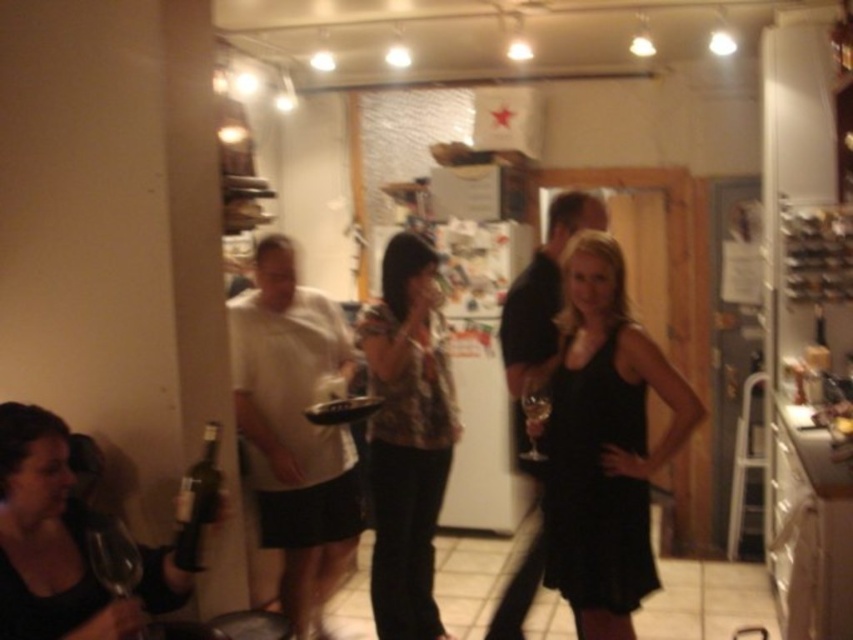
Question: Does black satin dress at center appear over transparent glass wine glass at lower left?

Choices:
 (A) no
 (B) yes

Answer: (B)

Question: Is dark red glass bottle at lower left positioned in front of transparent glass wine glass at center?

Choices:
 (A) yes
 (B) no

Answer: (A)

Question: Can you confirm if camouflage fabric shirt at center is positioned above matte black dress at lower left?

Choices:
 (A) no
 (B) yes

Answer: (A)

Question: Which object is the closest to the camouflage fabric shirt at center?

Choices:
 (A) transparent glass wine glass at center
 (B) black matte shirt at center
 (C) matte black dress at lower left

Answer: (B)

Question: Which object appears closest to the camera in this image?

Choices:
 (A) black satin dress at center
 (B) white matte t-shirt at center

Answer: (A)

Question: Estimate the real-world distances between objects in this image. Which object is farther from the camouflage fabric shirt at center?

Choices:
 (A) dark red glass bottle at lower left
 (B) translucent glass wine at center

Answer: (A)